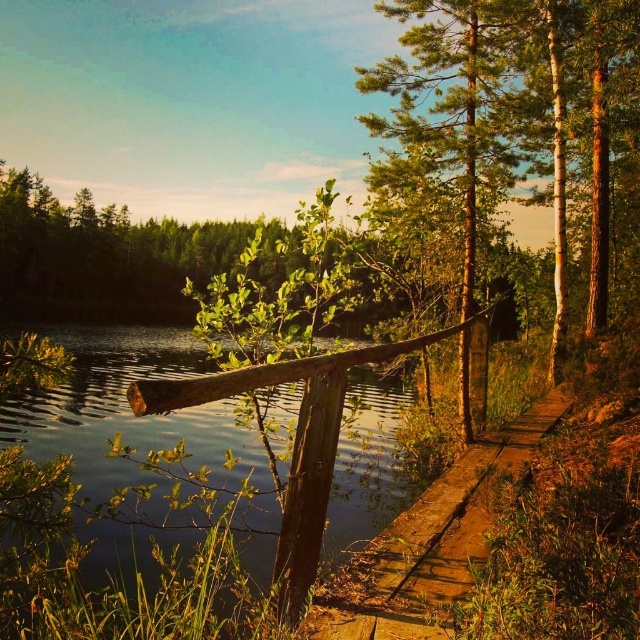
Question: In this image, where is transparent water at lower left located relative to wooden plank path at center?

Choices:
 (A) right
 (B) left

Answer: (B)

Question: Which point is farther to the camera?

Choices:
 (A) wooden plank path at center
 (B) transparent water at lower left

Answer: (A)

Question: Which point is farther from the camera taking this photo?

Choices:
 (A) (452, 561)
 (B) (172, 557)

Answer: (A)

Question: Is transparent water at lower left wider than wooden plank path at center?

Choices:
 (A) yes
 (B) no

Answer: (A)

Question: Is transparent water at lower left bigger than wooden plank path at center?

Choices:
 (A) no
 (B) yes

Answer: (B)